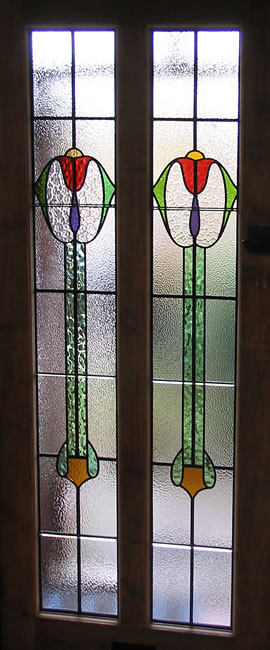
Locate an element on the screen. The height and width of the screenshot is (650, 270). glass is located at coordinates (191, 480).